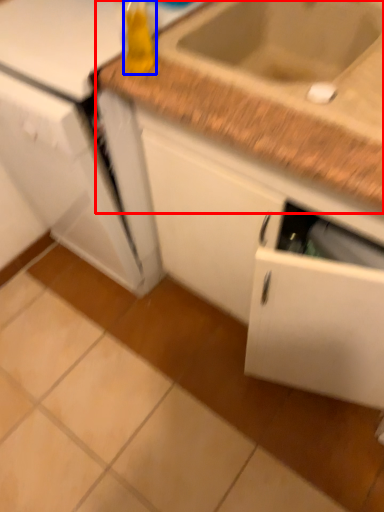
Question: Which point is closer to the camera, countertop (highlighted by a red box) or bottle (highlighted by a blue box)?

Choices:
 (A) countertop
 (B) bottle

Answer: (B)